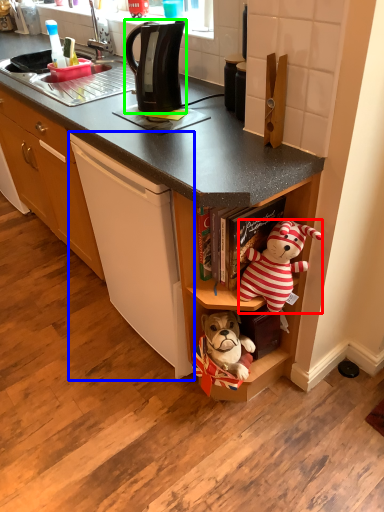
Question: Considering the real-world distances, which object is farthest from teddy bear (highlighted by a red box)? cording machine (highlighted by a blue box) or kitchen appliance (highlighted by a green box)?

Choices:
 (A) cording machine
 (B) kitchen appliance

Answer: (B)